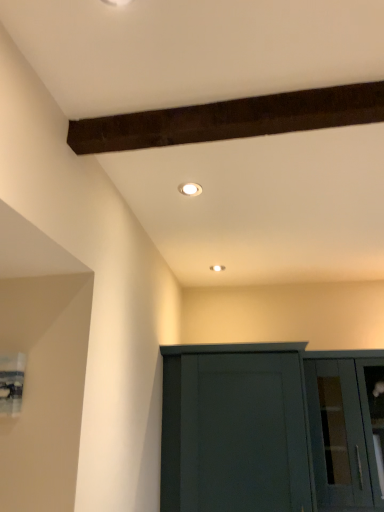
Question: Does white glossy light fixture at upper center touch matte dark green cupboard at lower center?

Choices:
 (A) no
 (B) yes

Answer: (A)

Question: Could you tell me if white glossy light fixture at upper center is facing matte dark green cupboard at lower center?

Choices:
 (A) no
 (B) yes

Answer: (A)

Question: From the image's perspective, would you say white glossy light fixture at upper center is positioned over matte dark green cupboard at lower center?

Choices:
 (A) yes
 (B) no

Answer: (A)

Question: Are white glossy light fixture at upper center and matte dark green cupboard at lower center located far from each other?

Choices:
 (A) yes
 (B) no

Answer: (A)

Question: Is white glossy light fixture at upper center smaller than matte dark green cupboard at lower center?

Choices:
 (A) yes
 (B) no

Answer: (A)

Question: Considering the positions of transparent glass cabinet at lower right and matte dark green cupboard at lower center in the image, is transparent glass cabinet at lower right bigger or smaller than matte dark green cupboard at lower center?

Choices:
 (A) big
 (B) small

Answer: (B)

Question: From a real-world perspective, is transparent glass cabinet at lower right physically located above or below matte dark green cupboard at lower center?

Choices:
 (A) below
 (B) above

Answer: (A)

Question: Would you say transparent glass cabinet at lower right is to the left or to the right of matte dark green cupboard at lower center in the picture?

Choices:
 (A) left
 (B) right

Answer: (B)

Question: In terms of width, does transparent glass cabinet at lower right look wider or thinner when compared to matte dark green cupboard at lower center?

Choices:
 (A) thin
 (B) wide

Answer: (A)

Question: Considering the positions of point (336, 441) and point (183, 190), is point (336, 441) closer or farther from the camera than point (183, 190)?

Choices:
 (A) closer
 (B) farther

Answer: (B)

Question: From a real-world perspective, is transparent glass cabinet at lower right physically located above or below white glossy light fixture at upper center?

Choices:
 (A) above
 (B) below

Answer: (B)

Question: In terms of height, does transparent glass cabinet at lower right look taller or shorter compared to white glossy light fixture at upper center?

Choices:
 (A) short
 (B) tall

Answer: (B)

Question: Based on their positions, is transparent glass cabinet at lower right located to the left or right of white glossy light fixture at upper center?

Choices:
 (A) left
 (B) right

Answer: (B)

Question: Is white glossy light fixture at upper center situated inside matte dark green cupboard at lower center or outside?

Choices:
 (A) outside
 (B) inside

Answer: (A)

Question: Based on their positions, is white glossy light fixture at upper center located to the left or right of matte dark green cupboard at lower center?

Choices:
 (A) left
 (B) right

Answer: (A)